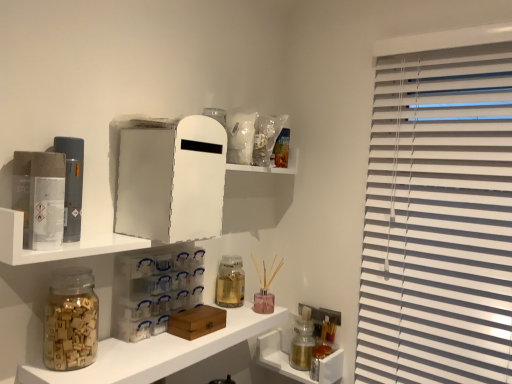
This screenshot has width=512, height=384. Find the location of `vacant space to the right of transparent plastic drawers at center, the first cabinet from the top`. vacant space to the right of transparent plastic drawers at center, the first cabinet from the top is located at coordinates (229, 322).